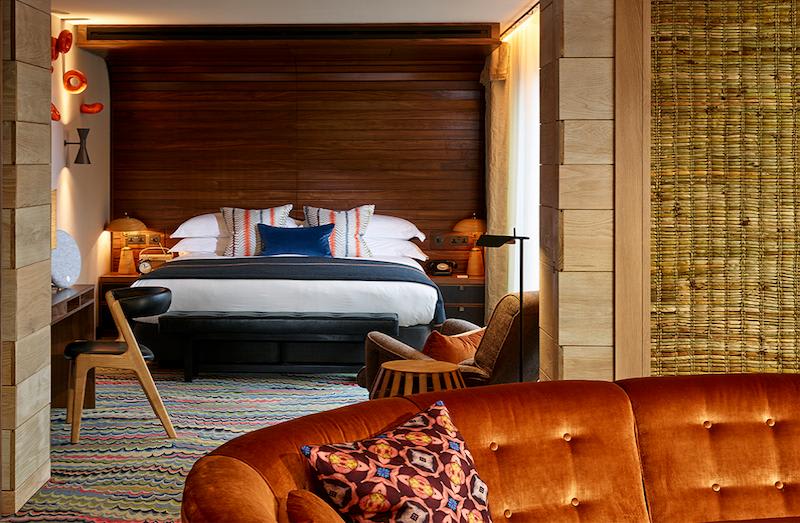
Locate an element on the screen. The height and width of the screenshot is (523, 800). dark wooden wall is located at coordinates (242, 130).